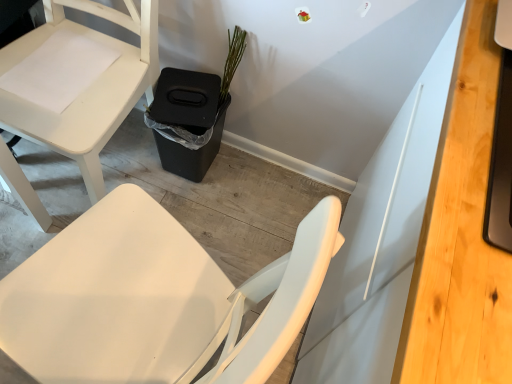
Question: From a real-world perspective, is black plastic trash bin at lower center located beneath white matte chair at lower left?

Choices:
 (A) no
 (B) yes

Answer: (B)

Question: Considering the relative positions of black plastic trash bin at lower center and white matte chair at lower left in the image provided, is black plastic trash bin at lower center to the left of white matte chair at lower left from the viewer's perspective?

Choices:
 (A) yes
 (B) no

Answer: (B)

Question: Can you confirm if black plastic trash bin at lower center is thinner than white matte chair at lower left?

Choices:
 (A) yes
 (B) no

Answer: (A)

Question: Is black plastic trash bin at lower center shorter than white matte chair at lower left?

Choices:
 (A) no
 (B) yes

Answer: (B)

Question: Is white matte chair at lower left at the back of black plastic trash bin at lower center?

Choices:
 (A) yes
 (B) no

Answer: (B)

Question: Can we say black plastic trash bin at lower center lies outside white matte chair at lower left?

Choices:
 (A) yes
 (B) no

Answer: (A)

Question: Can you confirm if white matte chair at lower left is shorter than black plastic trash bin at lower center?

Choices:
 (A) yes
 (B) no

Answer: (B)

Question: Is white matte chair at lower left positioned beyond the bounds of black plastic trash bin at lower center?

Choices:
 (A) no
 (B) yes

Answer: (B)

Question: Can you confirm if white matte chair at lower left is bigger than black plastic trash bin at lower center?

Choices:
 (A) no
 (B) yes

Answer: (B)

Question: Is black plastic trash bin at lower center at the back of white matte chair at lower left?

Choices:
 (A) no
 (B) yes

Answer: (A)

Question: Is white matte chair at lower left not near black plastic trash bin at lower center?

Choices:
 (A) no
 (B) yes

Answer: (A)

Question: Can you confirm if white matte chair at lower left is smaller than black plastic trash bin at lower center?

Choices:
 (A) yes
 (B) no

Answer: (B)

Question: Is white matte chair at lower left wider than light wood desk at right?

Choices:
 (A) yes
 (B) no

Answer: (A)